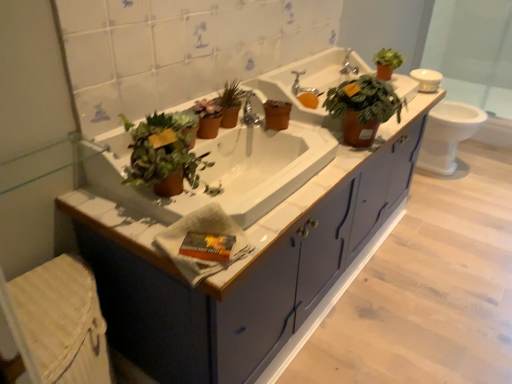
Find the location of `free location to the right of matte blue cabinet at center`. free location to the right of matte blue cabinet at center is located at coordinates (435, 269).